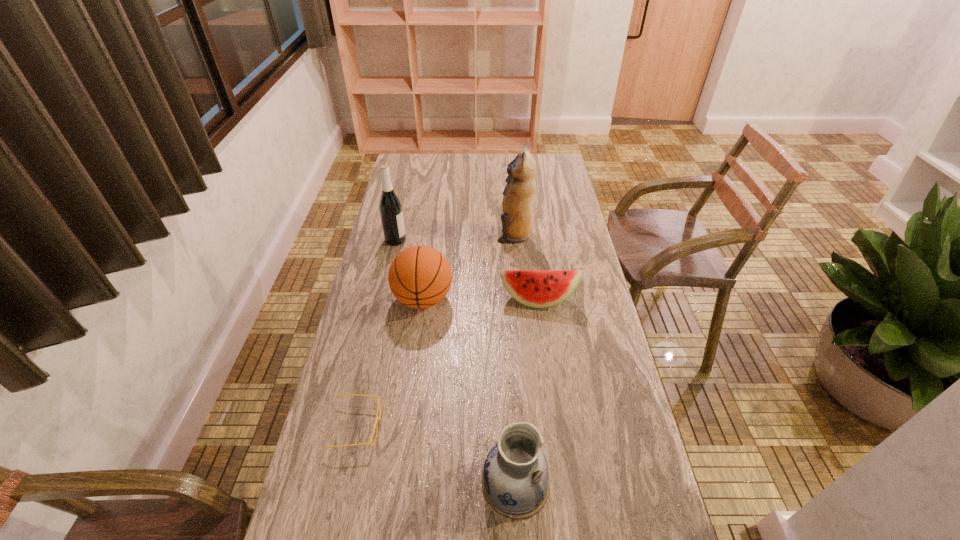
The image size is (960, 540). I want to click on blank space at the right edge, so click(x=566, y=190).

Identify the location of blank area at the far left corner. This screenshot has width=960, height=540. (410, 173).

Identify the location of free space that is in between the pottery and the fifth tallest object. The image size is (960, 540). (526, 392).

Identify the location of vacant region between the basketball and the pottery. The width and height of the screenshot is (960, 540). (469, 391).

Identify the location of unoccupied area between the spectacles and the watermelon. (446, 363).

Where is `vacant space that is in between the shortest object and the fifth tallest object`? This screenshot has width=960, height=540. vacant space that is in between the shortest object and the fifth tallest object is located at coordinates (446, 363).

You are a GUI agent. You are given a task and a screenshot of the screen. Output one action in this format:
    pyautogui.click(x=<x>, y=<y>)
    Task: Click on the vacant area between the pottery and the second shortest object
    The height and width of the screenshot is (540, 960).
    Given the screenshot: What is the action you would take?
    pyautogui.click(x=526, y=392)

Where is `free spot between the basketball and the cat`? free spot between the basketball and the cat is located at coordinates (468, 267).

This screenshot has height=540, width=960. Find the location of `vacant space in between the basketball and the pottery`. vacant space in between the basketball and the pottery is located at coordinates (469, 391).

Image resolution: width=960 pixels, height=540 pixels. Identify the location of unoccupied area between the second shortest object and the wine bottle. (467, 270).